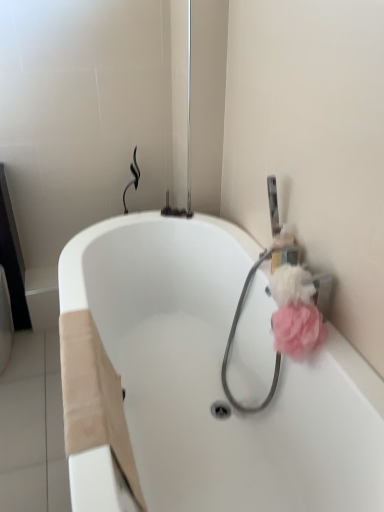
The width and height of the screenshot is (384, 512). What do you see at coordinates (219, 376) in the screenshot? I see `white glossy bathtub at center` at bounding box center [219, 376].

This screenshot has width=384, height=512. I want to click on pink fluffy sponge at right, placed as the 2th flower when sorted from bottom to top, so click(291, 285).

In the image, is pink fluffy sponge at right, which appears as the 1th flower when viewed from the top, positioned in front of or behind pink fabric garden hose at upper right?

pink fluffy sponge at right, which appears as the 1th flower when viewed from the top, is in front of pink fabric garden hose at upper right.

Identify the location of the 1st flower to the right of the pink fabric garden hose at upper right, starting your count from the anchor. The image size is (384, 512). (291, 285).

From a real-world perspective, is pink fluffy sponge at right, placed as the 2th flower when sorted from bottom to top, beneath pink fabric garden hose at upper right?

No, from a real-world perspective, pink fluffy sponge at right, placed as the 2th flower when sorted from bottom to top, is not below pink fabric garden hose at upper right.

Can you tell me how much pink fluffy sponge at right, which appears as the 1th flower when viewed from the top, and pink fabric garden hose at upper right differ in facing direction?

pink fluffy sponge at right, which appears as the 1th flower when viewed from the top, and pink fabric garden hose at upper right are facing 84.8 degrees away from each other.

Is pink fabric garden hose at upper right placed right next to white glossy bathtub at center?

No, pink fabric garden hose at upper right is not next to white glossy bathtub at center.

Is pink fabric garden hose at upper right positioned beyond the bounds of white glossy bathtub at center?

No, most part of pink fabric garden hose at upper right lies within white glossy bathtub at center.

Consider the image. Which point is more distant from viewer, (272,384) or (169,339)?

Positioned behind is point (169,339).

Considering the relative positions of white glossy bathtub at center and pink fluffy sponge at right, the 1th flower ordered from the bottom, in the image provided, is white glossy bathtub at center behind pink fluffy sponge at right, the 1th flower ordered from the bottom,?

No, white glossy bathtub at center is closer to the viewer.

Is white glossy bathtub at center wider or thinner than pink fluffy sponge at right, the 1th flower ordered from the bottom?

In the image, white glossy bathtub at center appears to be wider than pink fluffy sponge at right, the 1th flower ordered from the bottom.

How far apart are white glossy bathtub at center and pink fluffy sponge at right, arranged as the 2th flower when viewed from the top?

white glossy bathtub at center is 18.01 inches away from pink fluffy sponge at right, arranged as the 2th flower when viewed from the top.

Is point (212, 329) less distant than point (301, 325)?

That is False.

Is pink fabric garden hose at upper right surrounded by pink fluffy sponge at right, arranged as the 2th flower when viewed from the top?

No, pink fabric garden hose at upper right is not a part of pink fluffy sponge at right, arranged as the 2th flower when viewed from the top.

This screenshot has width=384, height=512. Find the location of `garden hose below the pink fluffy sponge at right, arranged as the 2th flower when viewed from the top (from a real-world perspective)`. garden hose below the pink fluffy sponge at right, arranged as the 2th flower when viewed from the top (from a real-world perspective) is located at coordinates (234, 334).

Can you confirm if pink fluffy sponge at right, arranged as the 2th flower when viewed from the top, is thinner than pink fabric garden hose at upper right?

Yes, pink fluffy sponge at right, arranged as the 2th flower when viewed from the top, is thinner than pink fabric garden hose at upper right.

Is pink fabric garden hose at upper right oriented away from pink fluffy sponge at right, placed as the 2th flower when sorted from bottom to top?

That's not correct — pink fabric garden hose at upper right is not looking away from pink fluffy sponge at right, placed as the 2th flower when sorted from bottom to top.

Considering their positions, is pink fabric garden hose at upper right located in front of or behind pink fluffy sponge at right, which appears as the 1th flower when viewed from the top?

Clearly, pink fabric garden hose at upper right is behind pink fluffy sponge at right, which appears as the 1th flower when viewed from the top.

Image resolution: width=384 pixels, height=512 pixels. In order to click on flower that is the 1st one when counting forward from the pink fabric garden hose at upper right in this screenshot , I will do `click(291, 285)`.

Looking at this image, can you confirm if pink fluffy sponge at right, arranged as the 2th flower when viewed from the top, is smaller than pink fluffy sponge at right, placed as the 2th flower when sorted from bottom to top?

Actually, pink fluffy sponge at right, arranged as the 2th flower when viewed from the top, might be larger than pink fluffy sponge at right, placed as the 2th flower when sorted from bottom to top.

Between pink fluffy sponge at right, the 1th flower ordered from the bottom, and pink fluffy sponge at right, placed as the 2th flower when sorted from bottom to top, which one has more height?

pink fluffy sponge at right, the 1th flower ordered from the bottom.

Is pink fluffy sponge at right, which appears as the 1th flower when viewed from the top, surrounded by pink fluffy sponge at right, arranged as the 2th flower when viewed from the top?

No, pink fluffy sponge at right, which appears as the 1th flower when viewed from the top, is not a part of pink fluffy sponge at right, arranged as the 2th flower when viewed from the top.

Is pink fluffy sponge at right, the 1th flower ordered from the bottom, positioned behind pink fluffy sponge at right, placed as the 2th flower when sorted from bottom to top?

No, it is in front of pink fluffy sponge at right, placed as the 2th flower when sorted from bottom to top.

From the image's perspective, which object appears higher, pink fluffy sponge at right, the 1th flower ordered from the bottom, or white glossy bathtub at center?

pink fluffy sponge at right, the 1th flower ordered from the bottom, appears higher in the image.

Is pink fluffy sponge at right, arranged as the 2th flower when viewed from the top, at the right side of white glossy bathtub at center?

Yes.

How far apart are pink fluffy sponge at right, the 1th flower ordered from the bottom, and white glossy bathtub at center?

pink fluffy sponge at right, the 1th flower ordered from the bottom, and white glossy bathtub at center are 18.01 inches apart.

Is the surface of pink fluffy sponge at right, the 1th flower ordered from the bottom, in direct contact with white glossy bathtub at center?

pink fluffy sponge at right, the 1th flower ordered from the bottom, and white glossy bathtub at center are not in contact.

Where is `garden hose lying behind the pink fluffy sponge at right, which appears as the 1th flower when viewed from the top`? The width and height of the screenshot is (384, 512). garden hose lying behind the pink fluffy sponge at right, which appears as the 1th flower when viewed from the top is located at coordinates pos(234,334).

Find the location of a particular element. This screenshot has height=512, width=384. garden hose above the white glossy bathtub at center (from the image's perspective) is located at coordinates (234, 334).

In the scene shown: Which object lies nearer to the anchor point pink fabric garden hose at upper right, white glossy bathtub at center or pink fluffy sponge at right, placed as the 2th flower when sorted from bottom to top?

pink fluffy sponge at right, placed as the 2th flower when sorted from bottom to top, is closer to pink fabric garden hose at upper right.

Looking at the image, which one is located closer to white glossy bathtub at center, pink fabric garden hose at upper right or pink fluffy sponge at right, placed as the 2th flower when sorted from bottom to top?

pink fabric garden hose at upper right.

Which object lies nearer to the anchor point white glossy bathtub at center, pink fluffy sponge at right, arranged as the 2th flower when viewed from the top, or pink fabric garden hose at upper right?

pink fabric garden hose at upper right is closer to white glossy bathtub at center.

From the image, which object appears to be farther from pink fluffy sponge at right, which appears as the 1th flower when viewed from the top, pink fluffy sponge at right, the 1th flower ordered from the bottom, or white glossy bathtub at center?

white glossy bathtub at center is positioned further to the anchor pink fluffy sponge at right, which appears as the 1th flower when viewed from the top.

Consider the image. From the image, which object appears to be nearer to white glossy bathtub at center, pink fluffy sponge at right, which appears as the 1th flower when viewed from the top, or pink fluffy sponge at right, arranged as the 2th flower when viewed from the top?

pink fluffy sponge at right, arranged as the 2th flower when viewed from the top, lies closer to white glossy bathtub at center than the other object.

Based on their spatial positions, is pink fluffy sponge at right, arranged as the 2th flower when viewed from the top, or white glossy bathtub at center further from pink fabric garden hose at upper right?

The object further to pink fabric garden hose at upper right is white glossy bathtub at center.

From the image, which object appears to be nearer to pink fluffy sponge at right, which appears as the 1th flower when viewed from the top, pink fabric garden hose at upper right or pink fluffy sponge at right, the 1th flower ordered from the bottom?

Among the two, pink fluffy sponge at right, the 1th flower ordered from the bottom, is located nearer to pink fluffy sponge at right, which appears as the 1th flower when viewed from the top.

Looking at the image, which one is located closer to pink fabric garden hose at upper right, pink fluffy sponge at right, which appears as the 1th flower when viewed from the top, or white glossy bathtub at center?

The object closer to pink fabric garden hose at upper right is pink fluffy sponge at right, which appears as the 1th flower when viewed from the top.

This screenshot has height=512, width=384. In order to click on flower between pink fluffy sponge at right, which appears as the 1th flower when viewed from the top, and pink fabric garden hose at upper right vertically in this screenshot , I will do `click(298, 330)`.

What are the coordinates of `flower positioned between white glossy bathtub at center and pink fluffy sponge at right, which appears as the 1th flower when viewed from the top, from near to far` in the screenshot? It's located at (298, 330).